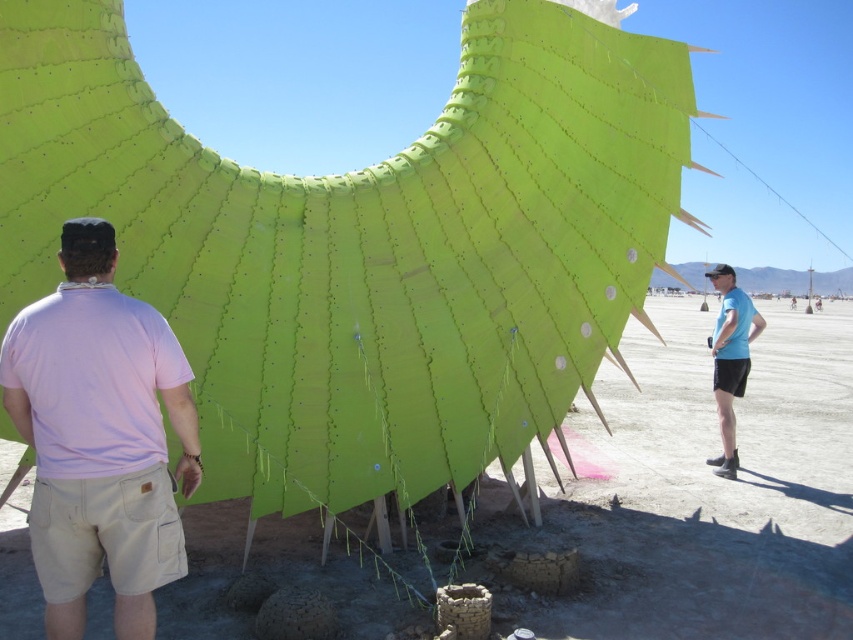
You are an artist standing in front of the dragon sculpture in the desert. You notice a pink cotton shirt at left and a blue fabric shirt at right. Which shirt is closer to the ground?

The pink cotton shirt at left is located below the blue fabric shirt at right, so it is closer to the ground.

You are standing at the base of the dragon sculpture and want to place a pink cotton shirt at left and a blue fabric shirt at right in such a way that they are both visible from the entrance of the desert area. Given their current positions, will the shirts be visible from the entrance?

The pink cotton shirt at left is 37.28 feet away from the blue fabric shirt at right. Since both shirts are placed at the base of the dragon sculpture, which is in a desert environment with open space, they should be visible from the entrance as there are no obstructions mentioned in the scene description.